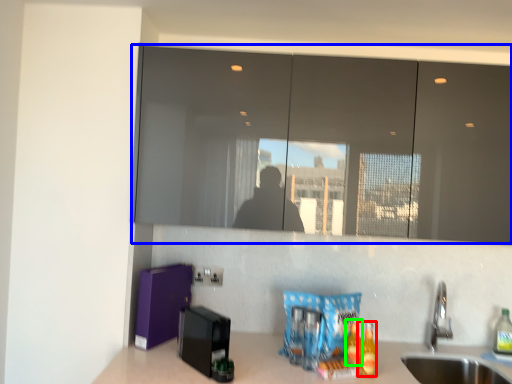
Question: Considering the real-world distances, which object is farthest from beverage (highlighted by a red box)? mirror (highlighted by a blue box) or beverage (highlighted by a green box)?

Choices:
 (A) mirror
 (B) beverage

Answer: (A)